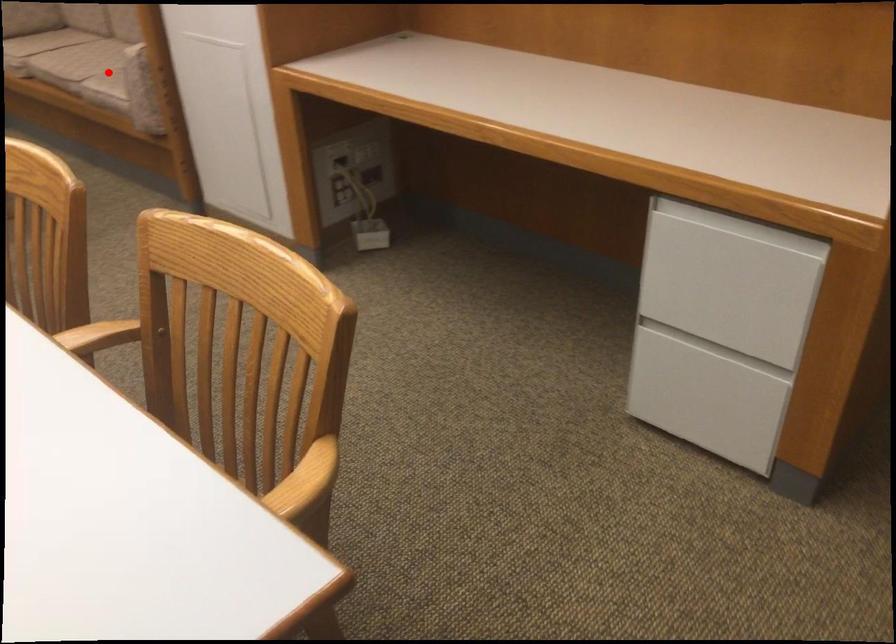
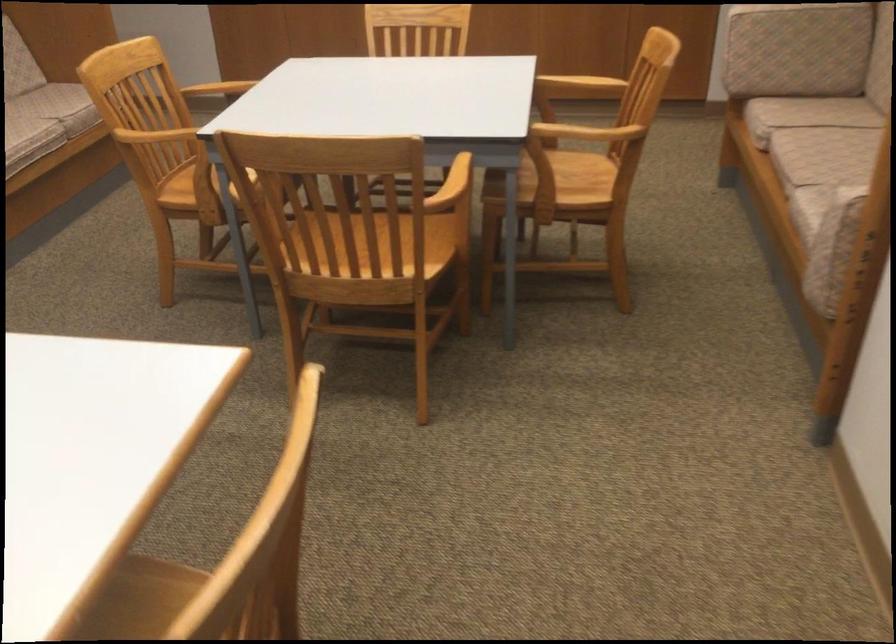
Question: I am providing you with two images of the same scene from different viewpoints. In image1, a red point is highlighted. Considering the same 3D point in image2, which of the following is correct?

Choices:
 (A) It is closer
 (B) It is farther

Answer: (A)